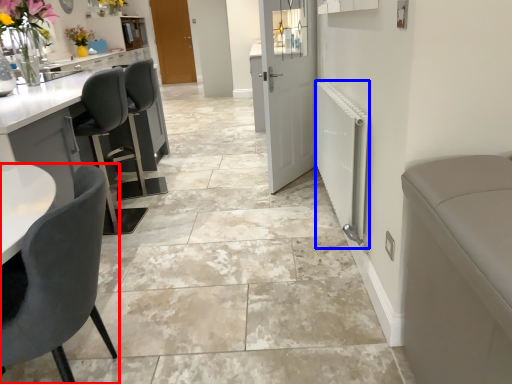
Question: Among these objects, which one is farthest to the camera, chair (highlighted by a red box) or radiator (highlighted by a blue box)?

Choices:
 (A) chair
 (B) radiator

Answer: (B)